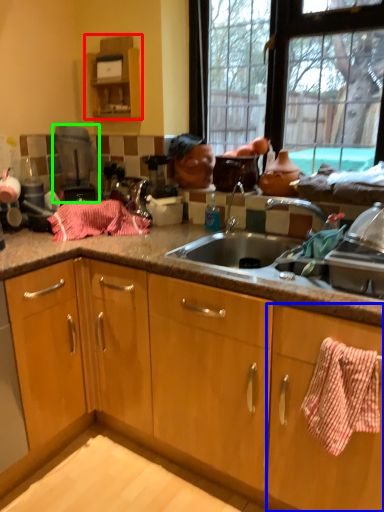
Question: Based on their relative distances, which object is farther from cabinetry (highlighted by a red box)? Choose from cabinetry (highlighted by a blue box) and appliance (highlighted by a green box).

Choices:
 (A) cabinetry
 (B) appliance

Answer: (A)